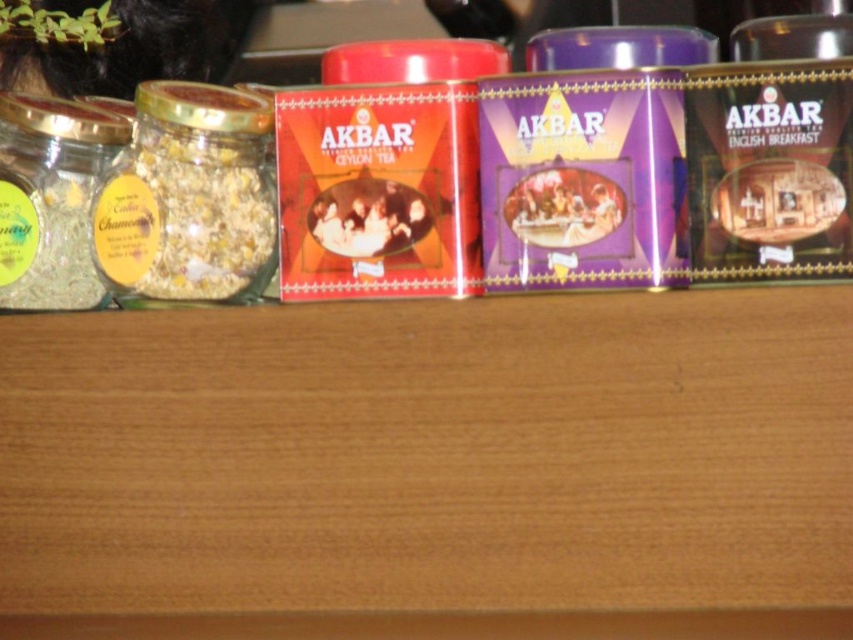
Which is above, translucent glass jar at left or clear glass jar at left?

translucent glass jar at left

Between translucent glass jar at left and clear glass jar at left, which one has more height?

clear glass jar at left is taller.

I want to click on translucent glass jar at left, so click(x=190, y=196).

Where is `translucent glass jar at left`? The height and width of the screenshot is (640, 853). translucent glass jar at left is located at coordinates coord(190,196).